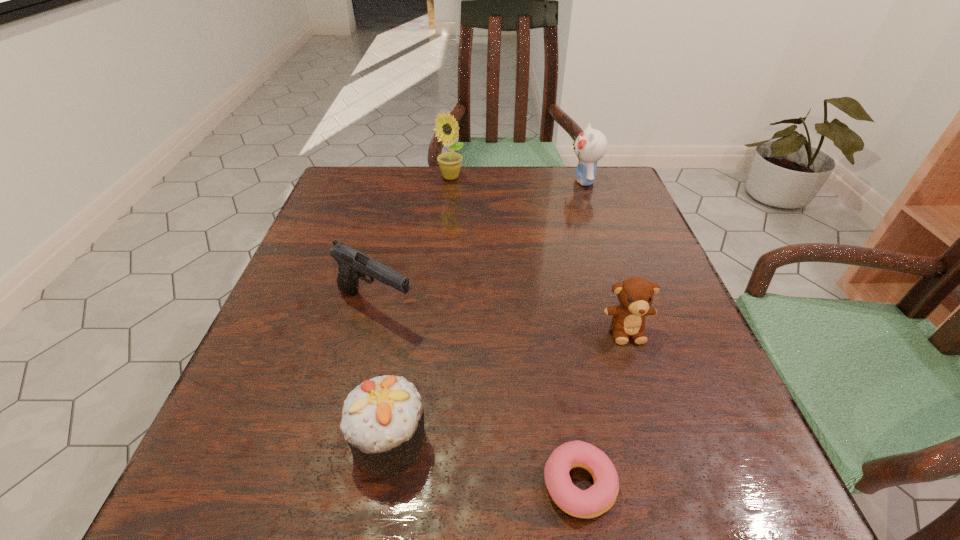
The image size is (960, 540). I want to click on sunflower, so click(x=450, y=162).

Identify the location of the fifth shortest object. This screenshot has height=540, width=960. (590, 146).

Identify the location of gun. The width and height of the screenshot is (960, 540). (353, 264).

Locate an element on the screen. teddy bear is located at coordinates (635, 294).

Image resolution: width=960 pixels, height=540 pixels. I want to click on cupcake, so click(382, 420).

The image size is (960, 540). Find the location of `doughnut`. doughnut is located at coordinates (600, 497).

Locate an element on the screen. The width and height of the screenshot is (960, 540). the shortest object is located at coordinates (600, 497).

In order to click on vacant area situated on the face of the tallest object in this screenshot , I will do `click(442, 269)`.

Locate an element on the screen. This screenshot has width=960, height=540. free location located 0.240m on the front-facing side of the kitten is located at coordinates (477, 181).

In order to click on free space located on the front-facing side of the kitten in this screenshot , I will do `click(534, 181)`.